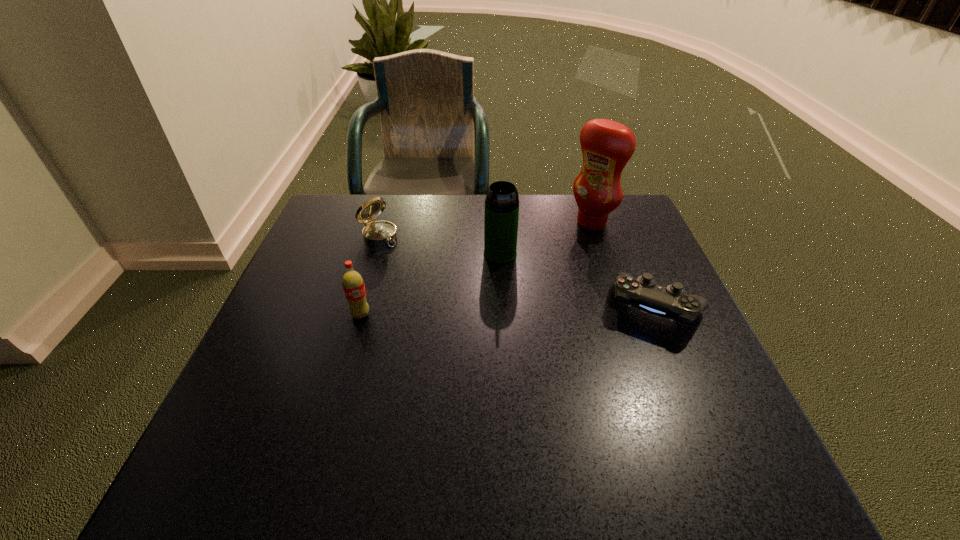
Where is `the third tallest object`? the third tallest object is located at coordinates (353, 284).

Locate an element on the screen. The image size is (960, 540). the shortest object is located at coordinates (672, 302).

Where is `compass`? compass is located at coordinates (375, 233).

This screenshot has width=960, height=540. In order to click on the tallest object in this screenshot , I will do `click(607, 146)`.

Where is `the third object from left to right`? Image resolution: width=960 pixels, height=540 pixels. the third object from left to right is located at coordinates (501, 217).

You are a GUI agent. You are given a task and a screenshot of the screen. Output one action in this format:
    pyautogui.click(x=<x>, y=<y>)
    Task: Click on the thermos bottle
    
    Given the screenshot: What is the action you would take?
    pyautogui.click(x=501, y=217)

Where is `free space located 0.110m on the right of the soda`? This screenshot has height=540, width=960. free space located 0.110m on the right of the soda is located at coordinates (421, 315).

Find the location of a particular element. This screenshot has width=960, height=540. free point located on the left of the control is located at coordinates (491, 309).

Identify the location of free space located with the dial facing the compass. (411, 260).

Image resolution: width=960 pixels, height=540 pixels. In order to click on vacant region located with the dial facing the compass in this screenshot , I will do `click(411, 260)`.